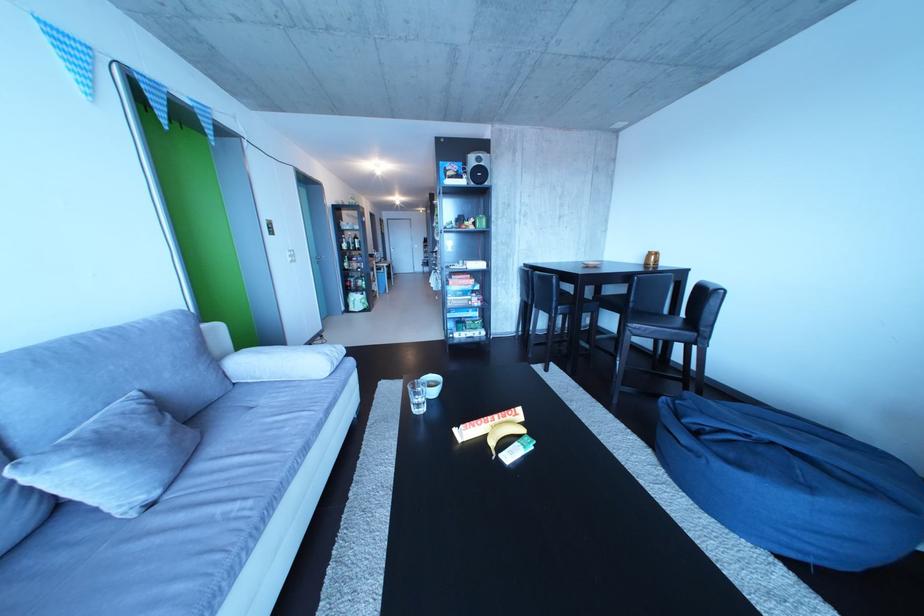
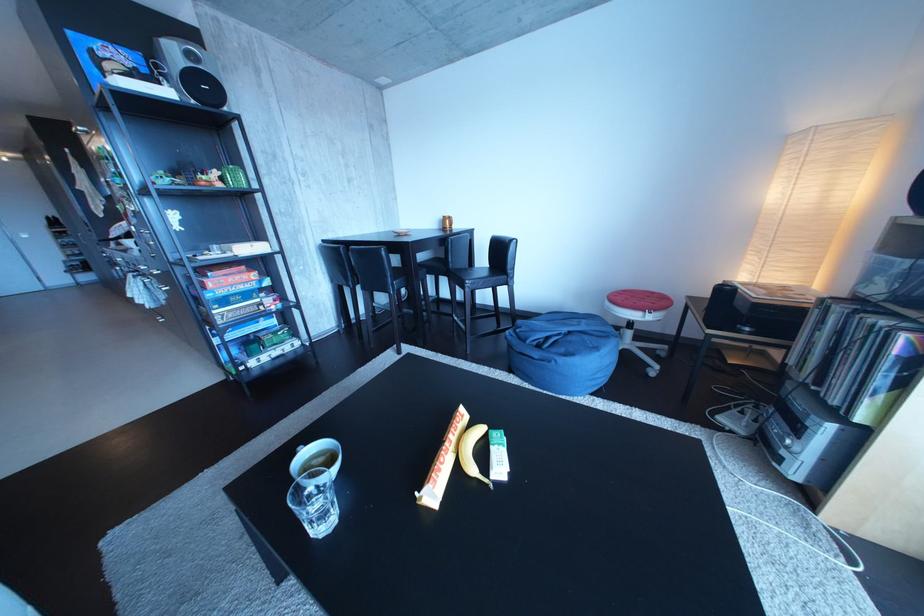
Find the pixel in the second image that matches pixel 478 431 in the first image.

(444, 487)